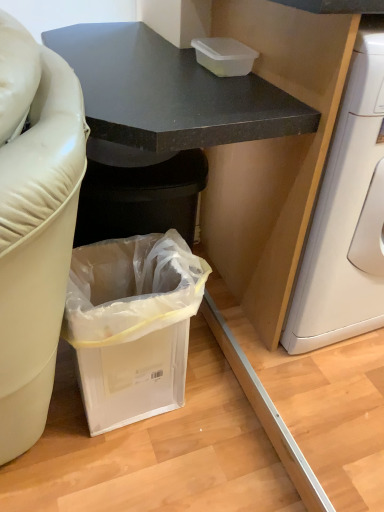
The height and width of the screenshot is (512, 384). What are the coordinates of `free location in front of clear plastic trash can at lower left` in the screenshot? It's located at (145, 471).